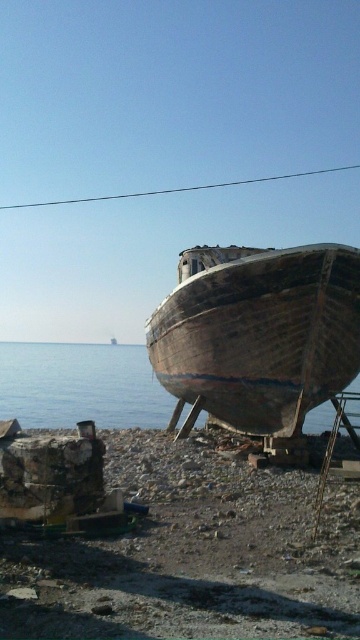
Question: Which object appears farthest from the camera in this image?

Choices:
 (A) blue wooden boat at center
 (B) rusty metallic boat at lower right
 (C) weathered wood boat at center

Answer: (C)

Question: Which object is closer to the camera taking this photo?

Choices:
 (A) weathered wood boat at center
 (B) blue wooden boat at center
 (C) rusty metallic boat at lower right

Answer: (C)

Question: Which point is closer to the camera taking this photo?

Choices:
 (A) (62, 392)
 (B) (240, 401)
 (C) (295, 554)

Answer: (C)

Question: Is weathered wood boat at center closer to the viewer compared to blue wooden boat at center?

Choices:
 (A) yes
 (B) no

Answer: (B)

Question: Is weathered wood boat at center to the right of blue wooden boat at center from the viewer's perspective?

Choices:
 (A) yes
 (B) no

Answer: (A)

Question: Does rusty metallic boat at lower right come behind weathered wood boat at center?

Choices:
 (A) no
 (B) yes

Answer: (A)